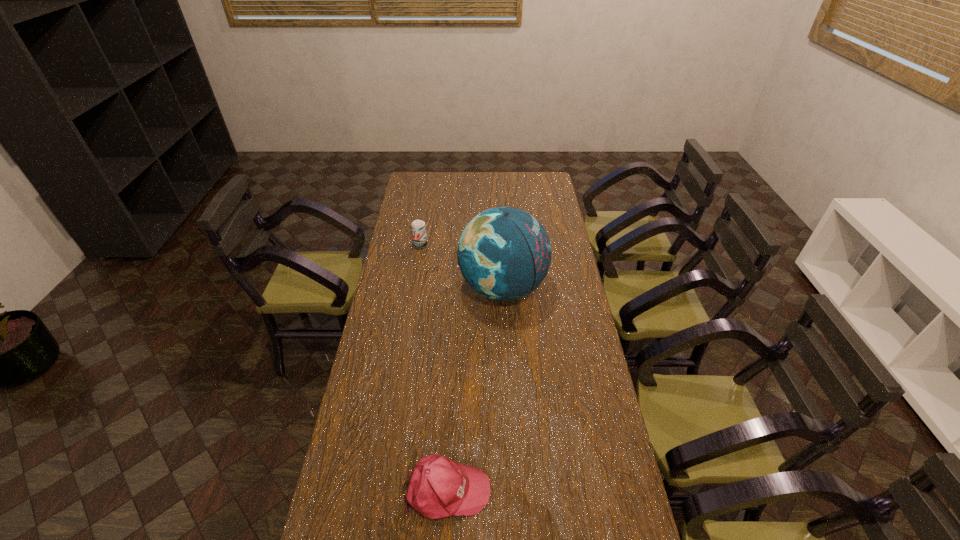
The image size is (960, 540). In order to click on free space at the far edge in this screenshot , I will do pos(484,193).

In the image, there is a desktop. Find the location of `vacant space at the left edge`. vacant space at the left edge is located at coordinates (390, 361).

You are a GUI agent. You are given a task and a screenshot of the screen. Output one action in this format:
    pyautogui.click(x=<x>, y=<y>)
    Task: Click on the free space at the right edge of the desktop
    
    Given the screenshot: What is the action you would take?
    pyautogui.click(x=561, y=326)

At what (x,y) coordinates should I click in order to perform the action: click on vacant space at the far left corner of the desktop. Please return your answer as a coordinate pair (x, y). Looking at the image, I should click on (426, 180).

In the image, there is a desktop. Where is `free space at the far right corner`? Image resolution: width=960 pixels, height=540 pixels. free space at the far right corner is located at coordinates 536,181.

Find the location of a particular element. This screenshot has height=540, width=960. free spot between the leftmost object and the nearest object is located at coordinates (434, 367).

Image resolution: width=960 pixels, height=540 pixels. I want to click on free space between the nearest object and the tallest object, so coord(475,389).

Locate an element on the screen. This screenshot has width=960, height=540. empty space that is in between the baseball cap and the second farthest object is located at coordinates (475, 389).

Where is `vacant area between the second farthest object and the baseball cap`? vacant area between the second farthest object and the baseball cap is located at coordinates (475, 389).

At what (x,y) coordinates should I click in order to perform the action: click on object that is the closest one to the second farthest object. Please return your answer as a coordinate pair (x, y). Image resolution: width=960 pixels, height=540 pixels. Looking at the image, I should click on (418, 227).